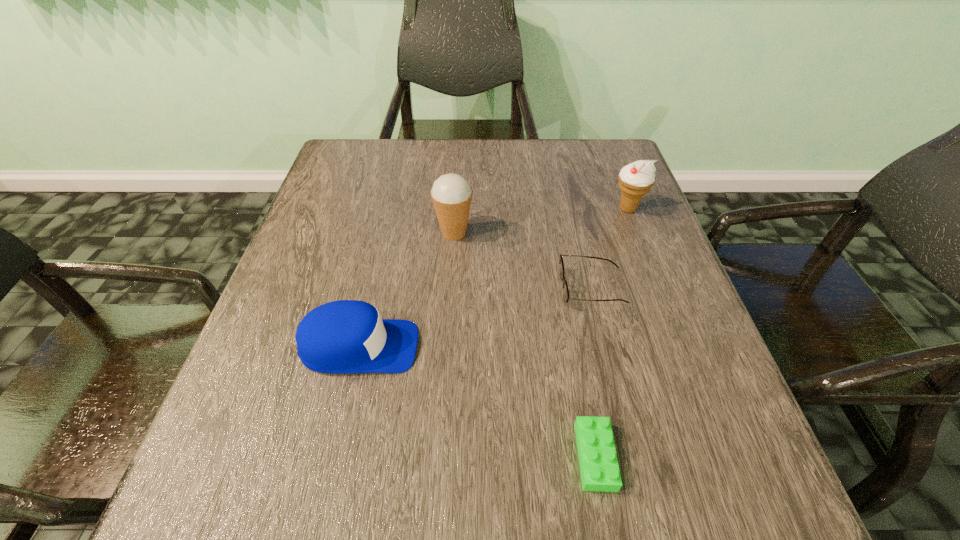
Identify the location of free space located on the front of the fourth nearest object. (449, 307).

At what (x,y) coordinates should I click in order to perform the action: click on vacant area situated 0.390m on the left of the farthest object. Please return your answer as a coordinate pair (x, y). This screenshot has height=540, width=960. Looking at the image, I should click on (453, 209).

This screenshot has height=540, width=960. Identify the location of blank area located 0.300m on the front-facing side of the baseball cap. (582, 347).

You are a GUI agent. You are given a task and a screenshot of the screen. Output one action in this format:
    pyautogui.click(x=<x>, y=<y>)
    Task: Click on the free space located 0.280m on the face of the second shortest object
    This screenshot has height=540, width=960.
    Given the screenshot: What is the action you would take?
    pyautogui.click(x=425, y=288)

Locate an element on the screen. This screenshot has width=960, height=540. vacant space positioned on the face of the second shortest object is located at coordinates (532, 288).

Where is `blank area located on the face of the second shortest object`? Image resolution: width=960 pixels, height=540 pixels. blank area located on the face of the second shortest object is located at coordinates (464, 288).

In order to click on blank space located on the left of the shortest object in this screenshot , I will do `click(326, 456)`.

Where is `object positioned at the near edge`? object positioned at the near edge is located at coordinates (599, 467).

This screenshot has height=540, width=960. What are the coordinates of `object situated at the left edge` in the screenshot? It's located at (346, 336).

Identify the location of icecream at the right edge. (636, 179).